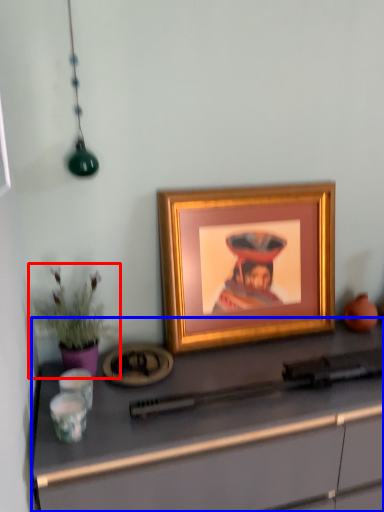
Question: Which object is closer to the camera taking this photo, houseplant (highlighted by a red box) or desk (highlighted by a blue box)?

Choices:
 (A) houseplant
 (B) desk

Answer: (B)